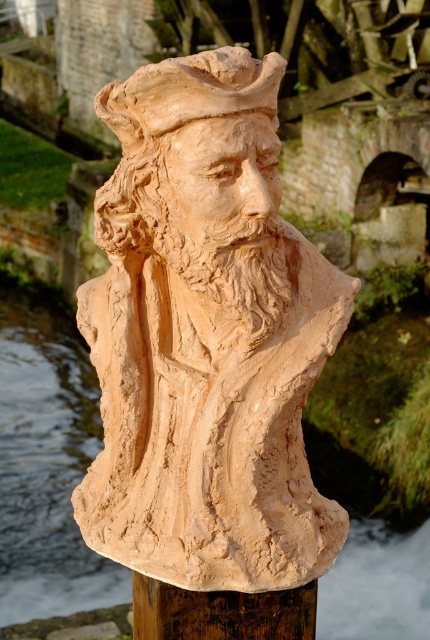
Question: Which object is farther from the camera taking this photo?

Choices:
 (A) terracotta statue at center
 (B) matte clay bust at center
 (C) terracotta sculpture at center

Answer: (B)

Question: Which point is farther to the camera?

Choices:
 (A) (146, 141)
 (B) (264, 56)
 (C) (254, 605)
 (D) (0, 433)

Answer: (D)

Question: Which of these objects is positioned closest to the brown wood post at center?

Choices:
 (A) terracotta sculpture at center
 (B) matte clay bust at center

Answer: (A)

Question: Considering the relative positions of matte clay bust at center and brown wood post at center in the image provided, where is matte clay bust at center located with respect to brown wood post at center?

Choices:
 (A) right
 (B) left

Answer: (B)

Question: Does terracotta statue at center appear on the left side of brown wood post at center?

Choices:
 (A) yes
 (B) no

Answer: (A)

Question: Does terracotta statue at center have a smaller size compared to matte clay bust at center?

Choices:
 (A) yes
 (B) no

Answer: (B)